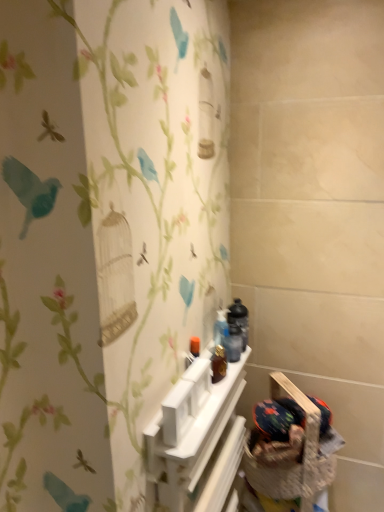
This screenshot has height=512, width=384. What do you see at coordinates (196, 441) in the screenshot? I see `white plastic shelf at center` at bounding box center [196, 441].

I want to click on white plastic shelf at center, so click(196, 441).

Find the location of a particular element. fluffy fabric basket at lower right is located at coordinates (272, 476).

What do you see at coordinates (272, 476) in the screenshot? The height and width of the screenshot is (512, 384). I see `fluffy fabric basket at lower right` at bounding box center [272, 476].

Image resolution: width=384 pixels, height=512 pixels. In order to click on white plastic shelf at center in this screenshot , I will do `click(196, 441)`.

Which object is positioned more to the right, white plastic shelf at center or fluffy fabric basket at lower right?

fluffy fabric basket at lower right is more to the right.

Considering the relative positions of white plastic shelf at center and fluffy fabric basket at lower right in the image provided, is white plastic shelf at center in front of fluffy fabric basket at lower right?

Yes, white plastic shelf at center is in front of fluffy fabric basket at lower right.

Which point is more distant from viewer, (x=186, y=487) or (x=266, y=485)?

The point (x=266, y=485) is more distant.

From the image's perspective, is white plastic shelf at center above or below fluffy fabric basket at lower right?

Based on their image positions, white plastic shelf at center is located beneath fluffy fabric basket at lower right.

From a real-world perspective, does white plastic shelf at center sit lower than fluffy fabric basket at lower right?

Yes.

Is white plastic shelf at center wider than fluffy fabric basket at lower right?

No.

Which of these two, white plastic shelf at center or fluffy fabric basket at lower right, stands shorter?

fluffy fabric basket at lower right is shorter.

Does white plastic shelf at center have a smaller size compared to fluffy fabric basket at lower right?

Incorrect, white plastic shelf at center is not smaller in size than fluffy fabric basket at lower right.

From the picture: Is fluffy fabric basket at lower right completely or partially inside white plastic shelf at center?

Result: No, fluffy fabric basket at lower right is not a part of white plastic shelf at center.

Is white plastic shelf at center beside fluffy fabric basket at lower right?

white plastic shelf at center and fluffy fabric basket at lower right are not in contact.

Is white plastic shelf at center oriented away from fluffy fabric basket at lower right?

That's right, white plastic shelf at center is facing away from fluffy fabric basket at lower right.

Can you tell me how much white plastic shelf at center and fluffy fabric basket at lower right differ in facing direction?

The facing directions of white plastic shelf at center and fluffy fabric basket at lower right are 44 degrees apart.

At what (x,y) coordinates should I click in order to perform the action: click on shelf that appears below the fluffy fabric basket at lower right (from the image's perspective). Please return your answer as a coordinate pair (x, y). The image size is (384, 512). Looking at the image, I should click on (196, 441).

Considering the relative positions of fluffy fabric basket at lower right and white plastic shelf at center in the image provided, is fluffy fabric basket at lower right to the left or to the right of white plastic shelf at center?

Based on their positions, fluffy fabric basket at lower right is located to the right of white plastic shelf at center.

In the image, is fluffy fabric basket at lower right positioned in front of or behind white plastic shelf at center?

fluffy fabric basket at lower right is behind white plastic shelf at center.

Which is closer to the camera, (276,479) or (196,481)?

Point (276,479).

From the image's perspective, is fluffy fabric basket at lower right below white plastic shelf at center?

No.

From a real-world perspective, is fluffy fabric basket at lower right located higher than white plastic shelf at center?

Yes, from a real-world perspective, fluffy fabric basket at lower right is on top of white plastic shelf at center.

Looking at their sizes, would you say fluffy fabric basket at lower right is wider or thinner than white plastic shelf at center?

fluffy fabric basket at lower right is wider than white plastic shelf at center.

Can you confirm if fluffy fabric basket at lower right is taller than white plastic shelf at center?

No, fluffy fabric basket at lower right is not taller than white plastic shelf at center.

Which of these two, fluffy fabric basket at lower right or white plastic shelf at center, is smaller?

With smaller size is fluffy fabric basket at lower right.

Is white plastic shelf at center completely or partially inside fluffy fabric basket at lower right?

Actually, white plastic shelf at center is outside fluffy fabric basket at lower right.

Can you see fluffy fabric basket at lower right touching white plastic shelf at center?

No, fluffy fabric basket at lower right is not making contact with white plastic shelf at center.

Is fluffy fabric basket at lower right facing away from white plastic shelf at center?

Yes, fluffy fabric basket at lower right's orientation is away from white plastic shelf at center.

Find the location of a particular element. basket container that is above the white plastic shelf at center (from the image's perspective) is located at coordinates (272, 476).

Find the location of `basket container that is behind the white plastic shelf at center`. basket container that is behind the white plastic shelf at center is located at coordinates (272, 476).

The image size is (384, 512). I want to click on basket container that is above the white plastic shelf at center (from the image's perspective), so click(x=272, y=476).